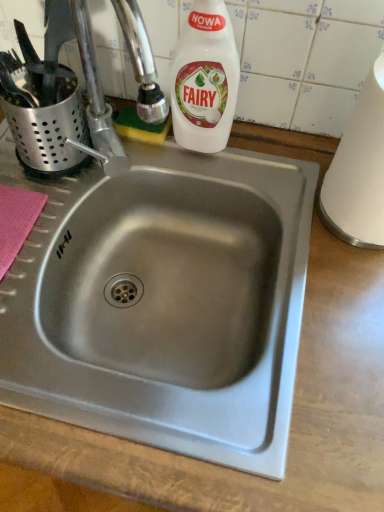
Question: Is white matte paper towel at right positioned before white plastic bottle at upper center?

Choices:
 (A) yes
 (B) no

Answer: (A)

Question: From a real-world perspective, is white matte paper towel at right located beneath white plastic bottle at upper center?

Choices:
 (A) no
 (B) yes

Answer: (A)

Question: Can you confirm if white matte paper towel at right is wider than white plastic bottle at upper center?

Choices:
 (A) no
 (B) yes

Answer: (B)

Question: Would you say white matte paper towel at right is a long distance from white plastic bottle at upper center?

Choices:
 (A) no
 (B) yes

Answer: (A)

Question: Could you tell me if white matte paper towel at right is turned towards white plastic bottle at upper center?

Choices:
 (A) no
 (B) yes

Answer: (A)

Question: Is white matte paper towel at right turned away from white plastic bottle at upper center?

Choices:
 (A) yes
 (B) no

Answer: (B)

Question: Can we say white plastic bottle at upper center lies outside white matte paper towel at right?

Choices:
 (A) no
 (B) yes

Answer: (B)

Question: Is white matte paper towel at right located within white plastic bottle at upper center?

Choices:
 (A) yes
 (B) no

Answer: (B)

Question: From the image's perspective, is white plastic bottle at upper center beneath white matte paper towel at right?

Choices:
 (A) yes
 (B) no

Answer: (B)

Question: Does white plastic bottle at upper center have a lesser width compared to white matte paper towel at right?

Choices:
 (A) no
 (B) yes

Answer: (B)

Question: Considering the relative positions of white plastic bottle at upper center and white matte paper towel at right in the image provided, is white plastic bottle at upper center to the left of white matte paper towel at right from the viewer's perspective?

Choices:
 (A) yes
 (B) no

Answer: (A)

Question: Does white plastic bottle at upper center turn towards white matte paper towel at right?

Choices:
 (A) no
 (B) yes

Answer: (A)

Question: In terms of height, does white plastic bottle at upper center look taller or shorter compared to white matte paper towel at right?

Choices:
 (A) short
 (B) tall

Answer: (A)